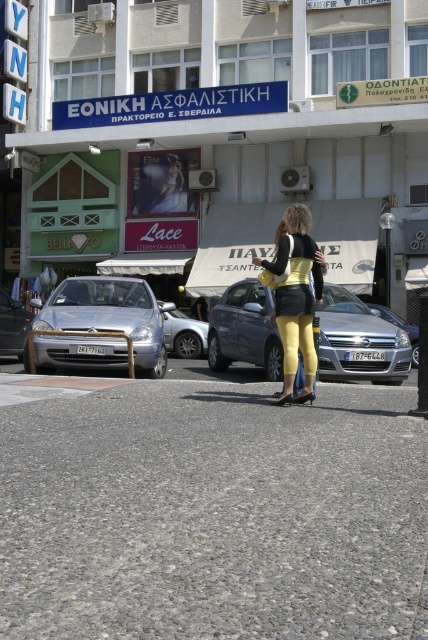
Between silver metallic sedan at left and satin silver sedan at center, which one appears on the left side from the viewer's perspective?

silver metallic sedan at left

Between silver metallic sedan at left and satin silver sedan at center, which one appears on the right side from the viewer's perspective?

Positioned to the right is satin silver sedan at center.

This screenshot has height=640, width=428. I want to click on silver metallic sedan at left, so click(x=12, y=324).

Does yellow matte leggings at center have a lesser height compared to satin silver sedan at center?

Incorrect, yellow matte leggings at center's height does not fall short of satin silver sedan at center's.

Can you confirm if yellow matte leggings at center is wider than satin silver sedan at center?

No, yellow matte leggings at center is not wider than satin silver sedan at center.

At what (x,y) coordinates should I click in order to perform the action: click on yellow matte leggings at center. Please return your answer as a coordinate pair (x, y). Looking at the image, I should click on (296, 298).

Locate an element on the screen. The height and width of the screenshot is (640, 428). yellow matte leggings at center is located at coordinates pos(296,298).

Is silver metallic car at center smaller than satin silver sedan at center?

Yes, silver metallic car at center is smaller than satin silver sedan at center.

In the scene shown: Which of these two, silver metallic car at center or satin silver sedan at center, stands shorter?

With less height is silver metallic car at center.

Is point (166, 332) more distant than point (413, 364)?

Yes, point (166, 332) is behind point (413, 364).

At what (x,y) coordinates should I click in order to perform the action: click on silver metallic car at center. Please return your answer as a coordinate pair (x, y). Looking at the image, I should click on (184, 333).